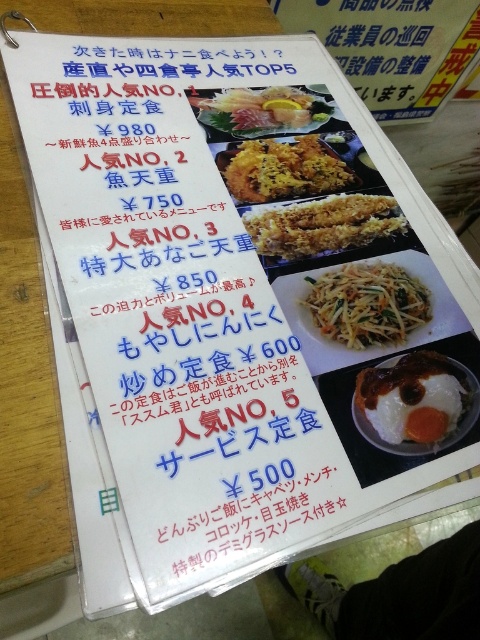
Is point (361, 209) farther from viewer compared to point (210, 113)?

No, it is not.

Is golden crispy fried at center behind shiny silver sashimi at upper center?

No, golden crispy fried at center is closer to the viewer.

At what (x,y) coordinates should I click in order to perform the action: click on golden crispy fried at center. Please return your answer as a coordinate pair (x, y). Image resolution: width=480 pixels, height=640 pixels. Looking at the image, I should click on (324, 225).

What do you see at coordinates (367, 305) in the screenshot?
I see `yellowish matte noodles at center` at bounding box center [367, 305].

Between yellowish matte noodles at center and shiny silver sashimi at upper center, which one appears on the left side from the viewer's perspective?

shiny silver sashimi at upper center

Is point (368, 346) closer to camera compared to point (229, 128)?

Yes, it is.

Where is `yellowish matte noodles at center`? yellowish matte noodles at center is located at coordinates (367, 305).

Is golden crispy fried chicken at center in front of shiny silver sashimi at upper center?

Yes, it is in front of shiny silver sashimi at upper center.

Between point (243, 168) and point (267, 118), which one is positioned behind?

The point (267, 118) is more distant.

Where is `golden crispy fried chicken at center`? golden crispy fried chicken at center is located at coordinates (284, 170).